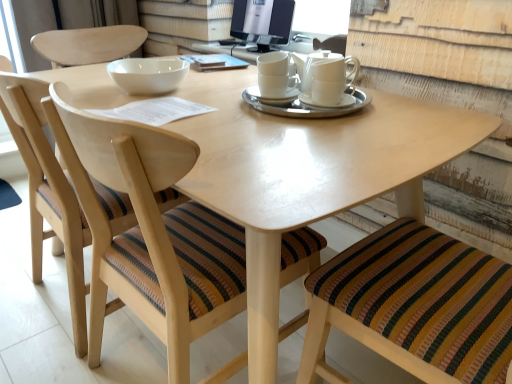
Locate an element on the screen. white glossy cup at center is located at coordinates (274, 75).

Image resolution: width=512 pixels, height=384 pixels. What do you see at coordinates (307, 107) in the screenshot? I see `white ceramic saucer at center, marked as the 2th saucer in a left-to-right arrangement` at bounding box center [307, 107].

What are the coordinates of `striped fabric chair at lower right, positioned as the first chair in right-to-left order` in the screenshot? It's located at (414, 306).

Where is `matte black monitor at upper center`? matte black monitor at upper center is located at coordinates (262, 22).

At what (x,y) coordinates should I click in order to perform the action: click on white glossy cup at center. Please return your answer as a coordinate pair (x, y). This screenshot has width=512, height=384. Looking at the image, I should click on (274, 75).

Between wooden chair with striped cushion at center, the 2th chair in the left-to-right sequence, and white glossy bowl at upper center, which one has less height?

With less height is white glossy bowl at upper center.

Identify the location of bowl that is behind the wooden chair with striped cushion at center, the 2th chair from the right. This screenshot has width=512, height=384. (148, 75).

Is point (242, 364) positioned behind point (108, 69)?

No, it is in front of (108, 69).

Measure the distance between wooden chair with striped cushion at center, the 2th chair in the left-to-right sequence, and white glossy bowl at upper center.

wooden chair with striped cushion at center, the 2th chair in the left-to-right sequence, and white glossy bowl at upper center are 20.78 inches apart.

Is white ceramic saucer at center, the 3th saucer when ordered from right to left, oriented towards white glossy teapot at center?

No, white ceramic saucer at center, the 3th saucer when ordered from right to left, is not turned towards white glossy teapot at center.

There is a white ceramic saucer at center, arranged as the first saucer when viewed from the left. At what (x,y) coordinates should I click in order to perform the action: click on teapot above it (from a real-world perspective). Please return your answer as a coordinate pair (x, y). This screenshot has height=384, width=512. Looking at the image, I should click on [x=328, y=80].

Which is further, (254, 87) or (334, 68)?

Point (254, 87)

Between point (290, 18) and point (256, 88), which one is positioned behind?

The point (290, 18) is more distant.

In the scene shown: Could you measure the distance between matte black monitor at upper center and white ceramic saucer at center, arranged as the first saucer when viewed from the left?

31.03 inches.

Consider the image. From the image's perspective, is matte black monitor at upper center located beneath white ceramic saucer at center, arranged as the first saucer when viewed from the left?

Actually, matte black monitor at upper center appears above white ceramic saucer at center, arranged as the first saucer when viewed from the left, in the image.

Would you consider matte black monitor at upper center to be distant from white ceramic saucer at center, the 3th saucer when ordered from right to left?

No.

Which object is further away from the camera taking this photo, white ceramic saucer at center, the 3th saucer when ordered from right to left, or white glossy cup at center?

white ceramic saucer at center, the 3th saucer when ordered from right to left.

Which is more to the left, white ceramic saucer at center, the 3th saucer when ordered from right to left, or white glossy cup at center?

Positioned to the left is white ceramic saucer at center, the 3th saucer when ordered from right to left.

At what (x,y) coordinates should I click in order to perform the action: click on the 2nd saucer positioned below the white glossy cup at center (from the image's perspective). Please return your answer as a coordinate pair (x, y). Looking at the image, I should click on (272, 96).

Looking at this image, is white ceramic saucer at center, arranged as the first saucer when viewed from the left, not inside white glossy cup at center?

Yes, white ceramic saucer at center, arranged as the first saucer when viewed from the left, is located beyond the bounds of white glossy cup at center.

Is wooden chair with striped cushion at lower left, the 1th chair in the left-to-right sequence, in front of or behind striped fabric chair at lower right, positioned as the first chair in right-to-left order, in the image?

Clearly, wooden chair with striped cushion at lower left, the 1th chair in the left-to-right sequence, is behind striped fabric chair at lower right, positioned as the first chair in right-to-left order.

From a real-world perspective, is wooden chair with striped cushion at lower left, arranged as the 3th chair when viewed from the right, located beneath striped fabric chair at lower right, positioned as the first chair in right-to-left order?

Yes, from a real-world perspective, wooden chair with striped cushion at lower left, arranged as the 3th chair when viewed from the right, is under striped fabric chair at lower right, positioned as the first chair in right-to-left order.

Looking at this image, are wooden chair with striped cushion at lower left, arranged as the 3th chair when viewed from the right, and striped fabric chair at lower right, the third chair positioned from the left, located far from each other?

No, wooden chair with striped cushion at lower left, arranged as the 3th chair when viewed from the right, is not far away from striped fabric chair at lower right, the third chair positioned from the left.

Is wooden chair with striped cushion at lower left, arranged as the 3th chair when viewed from the right, at the left side of striped fabric chair at lower right, positioned as the first chair in right-to-left order?

Indeed, wooden chair with striped cushion at lower left, arranged as the 3th chair when viewed from the right, is positioned on the left side of striped fabric chair at lower right, positioned as the first chair in right-to-left order.

Is matte black monitor at upper center facing towards wooden chair with striped cushion at lower left, the 1th chair in the left-to-right sequence?

No, matte black monitor at upper center is not aimed at wooden chair with striped cushion at lower left, the 1th chair in the left-to-right sequence.

Considering the relative sizes of matte black monitor at upper center and wooden chair with striped cushion at lower left, the 1th chair in the left-to-right sequence, in the image provided, is matte black monitor at upper center smaller than wooden chair with striped cushion at lower left, the 1th chair in the left-to-right sequence,?

Yes, matte black monitor at upper center is smaller than wooden chair with striped cushion at lower left, the 1th chair in the left-to-right sequence.

In the scene shown: Between matte black monitor at upper center and wooden chair with striped cushion at lower left, arranged as the 3th chair when viewed from the right, which one has smaller width?

Thinner between the two is matte black monitor at upper center.

Would you say matte black monitor at upper center is inside or outside white ceramic saucer at center, the 3th saucer from the left?

The correct answer is: outside.

How many degrees apart are the facing directions of matte black monitor at upper center and white ceramic saucer at center, the first saucer positioned from the right?

The angle between the facing direction of matte black monitor at upper center and the facing direction of white ceramic saucer at center, the first saucer positioned from the right, is 30.9 degrees.

In the image, is matte black monitor at upper center on the left side or the right side of white ceramic saucer at center, the first saucer positioned from the right?

matte black monitor at upper center is to the left of white ceramic saucer at center, the first saucer positioned from the right.

Relative to white ceramic saucer at center, the first saucer positioned from the right, is matte black monitor at upper center in front or behind?

Visually, matte black monitor at upper center is located behind white ceramic saucer at center, the first saucer positioned from the right.

You are a GUI agent. You are given a task and a screenshot of the screen. Output one action in this format:
    pyautogui.click(x=<x>, y=<y>)
    Task: Click on the bowl above the wooden chair with striped cushion at center, the 2th chair in the left-to-right sequence (from the image's perspective)
    The height and width of the screenshot is (384, 512).
    Given the screenshot: What is the action you would take?
    pyautogui.click(x=148, y=75)

Image resolution: width=512 pixels, height=384 pixels. I want to click on teapot located above the white ceramic saucer at center, arranged as the first saucer when viewed from the left (from a real-world perspective), so click(x=328, y=80).

Estimate the real-world distances between objects in this image. Which object is further from white ceramic saucer at center, positioned as the 2th saucer in right-to-left order, white glossy teapot at center or white ceramic saucer at center, the first saucer positioned from the right?

white glossy teapot at center is positioned further to the anchor white ceramic saucer at center, positioned as the 2th saucer in right-to-left order.

From the image, which object appears to be farther from white ceramic saucer at center, marked as the 2th saucer in a left-to-right arrangement, striped fabric chair at lower right, positioned as the first chair in right-to-left order, or white glossy teapot at center?

striped fabric chair at lower right, positioned as the first chair in right-to-left order.

From the image, which object appears to be farther from white glossy cup at center, striped fabric chair at lower right, positioned as the first chair in right-to-left order, or matte black monitor at upper center?

matte black monitor at upper center is positioned further to the anchor white glossy cup at center.

Which object lies nearer to the anchor point white ceramic saucer at center, the first saucer positioned from the right, white glossy bowl at upper center or matte black monitor at upper center?

white glossy bowl at upper center is closer to white ceramic saucer at center, the first saucer positioned from the right.

From the image, which object appears to be nearer to striped fabric chair at lower right, positioned as the first chair in right-to-left order, white ceramic saucer at center, the first saucer positioned from the right, or wooden chair with striped cushion at lower left, the 1th chair in the left-to-right sequence?

white ceramic saucer at center, the first saucer positioned from the right, is positioned closer to the anchor striped fabric chair at lower right, positioned as the first chair in right-to-left order.

Based on their spatial positions, is white glossy teapot at center or white glossy cup at center further from wooden chair with striped cushion at lower left, arranged as the 3th chair when viewed from the right?

white glossy teapot at center lies further to wooden chair with striped cushion at lower left, arranged as the 3th chair when viewed from the right, than the other object.

When comparing their distances from white glossy cup at center, does white glossy teapot at center or white ceramic saucer at center, the 3th saucer from the left, seem further?

white ceramic saucer at center, the 3th saucer from the left, is further to white glossy cup at center.

Which object lies nearer to the anchor point striped fabric chair at lower right, the third chair positioned from the left, white glossy bowl at upper center or matte wood table at center?

The object closer to striped fabric chair at lower right, the third chair positioned from the left, is matte wood table at center.

This screenshot has width=512, height=384. What are the coordinates of `coffee cup located between white ceramic saucer at center, the 3th saucer from the left, and matte black monitor at upper center in the depth direction` in the screenshot? It's located at (274, 75).

In order to click on teapot between wooden chair with striped cushion at center, the 2th chair in the left-to-right sequence, and matte black monitor at upper center in the front-back direction in this screenshot , I will do `click(328, 80)`.

The image size is (512, 384). What are the coordinates of `round table located between striped fabric chair at lower right, the third chair positioned from the left, and white ceramic saucer at center, the 3th saucer when ordered from right to left, in the depth direction` in the screenshot? It's located at (315, 153).

You are a GUI agent. You are given a task and a screenshot of the screen. Output one action in this format:
    pyautogui.click(x=<x>, y=<y>)
    Task: Click on the coffee cup between matte wood table at center and matte black monitor at upper center along the z-axis
    This screenshot has width=512, height=384.
    Given the screenshot: What is the action you would take?
    pyautogui.click(x=274, y=75)